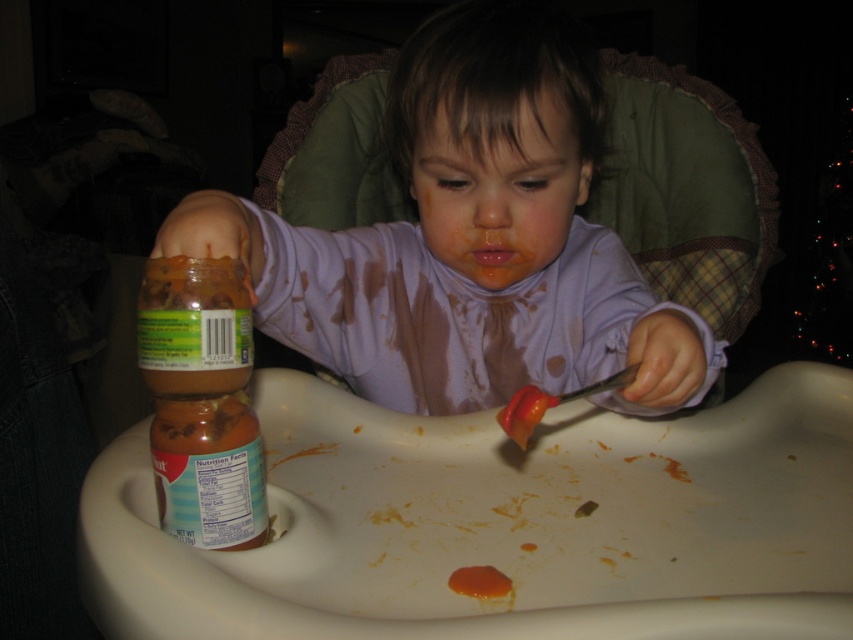
Question: Can you confirm if smooth orange carrot at center is thinner than smooth orange puree at center?

Choices:
 (A) yes
 (B) no

Answer: (B)

Question: Among these objects, which one is farthest from the camera?

Choices:
 (A) smooth orange carrot at center
 (B) matte plastic baby at center
 (C) smooth orange puree at center

Answer: (A)

Question: Is matte plastic baby at center wider than smooth orange carrot at center?

Choices:
 (A) yes
 (B) no

Answer: (A)

Question: Which object is positioned closest to the matte plastic baby at center?

Choices:
 (A) smooth orange carrot at center
 (B) smooth orange puree at center

Answer: (A)

Question: In this image, where is smooth orange carrot at center located relative to smooth orange puree at center?

Choices:
 (A) right
 (B) left

Answer: (A)

Question: Which of these objects is positioned farthest from the matte plastic baby at center?

Choices:
 (A) smooth orange puree at center
 (B) smooth orange carrot at center

Answer: (A)